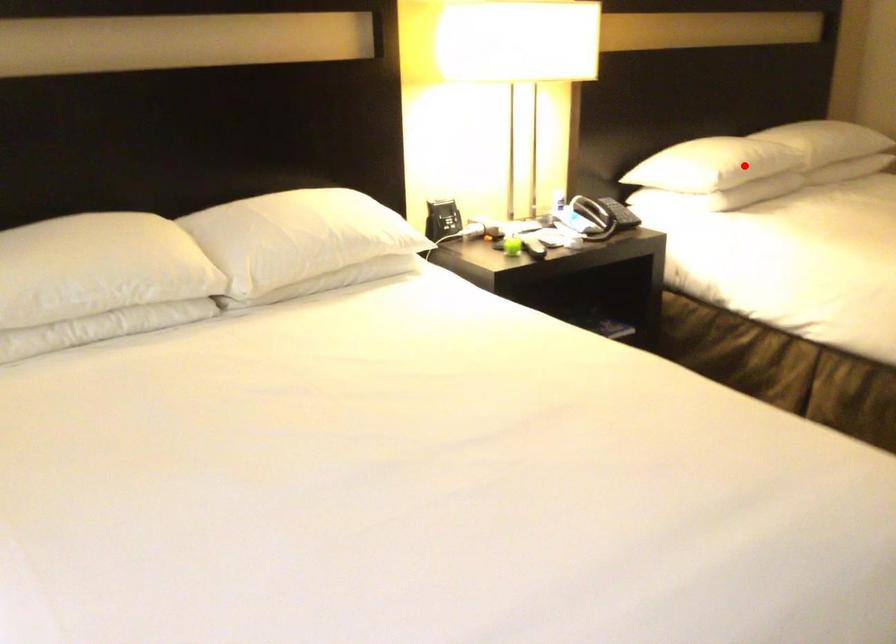
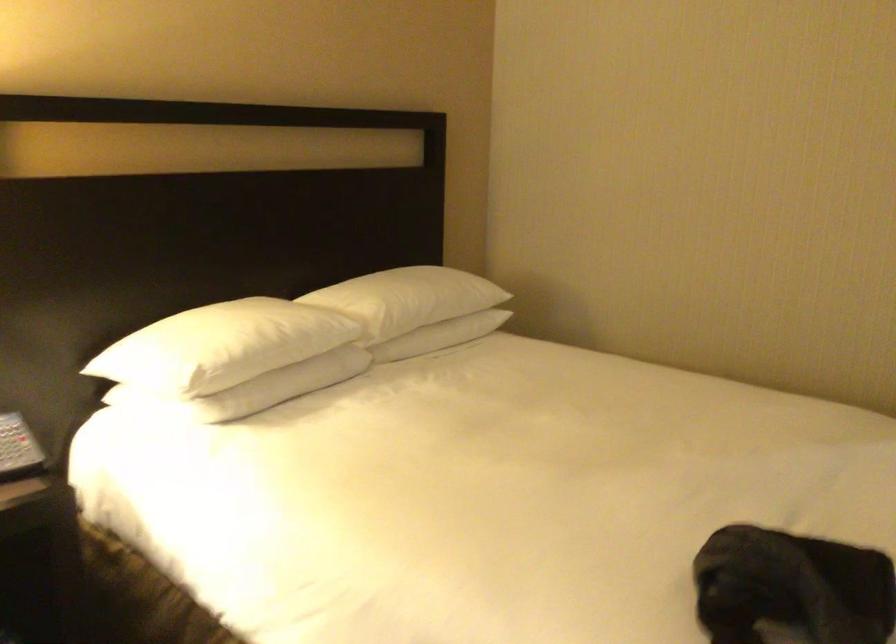
Where in the second image is the point corresponding to the highlighted location from the first image?

(253, 355)